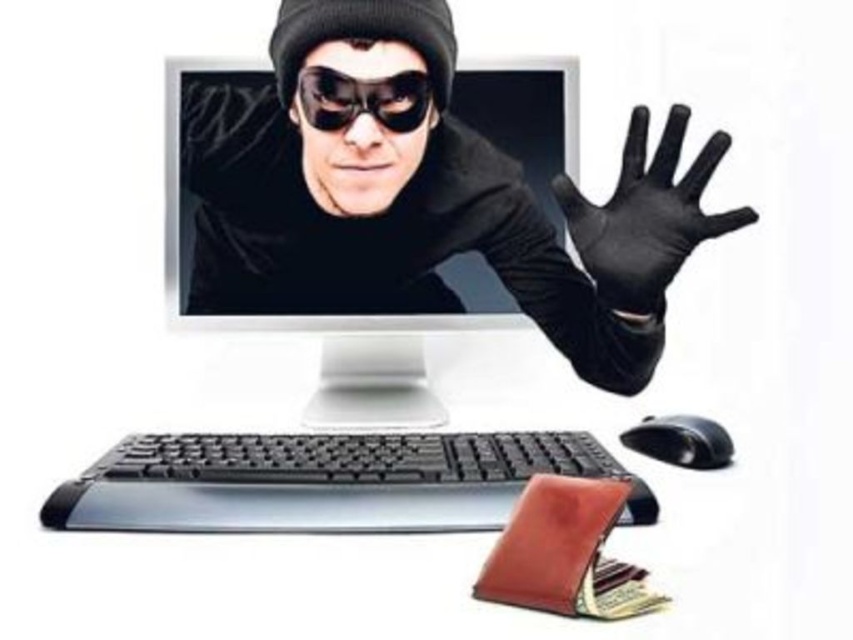
You are setting up a virtual reality station and need to place the black matte goggles at center and the black plastic mouse at lower right. According to the image, which object is positioned to the left of the other?

The black matte goggles at center are positioned to the left of the black plastic mouse at lower right.

You are setting up a computer desk and need to place the black matte goggles at center and the black plastic mouse at lower right. Based on their positions, which object is closer to the top edge of the desk?

The black matte goggles at center are closer to the top edge of the desk since they are positioned above the black plastic mouse at lower right.

You are a technician trying to fix a computer. You have a tool that requires a minimum of 16 inches of space between the black matte goggles at center and the black plastic mouse at lower right to operate safely. Can you use this tool in the current setup?

The distance between the black matte goggles at center and the black plastic mouse at lower right is 17.04 inches, which exceeds the minimum required 16 inches. Therefore, you can safely use the tool in the current setup.